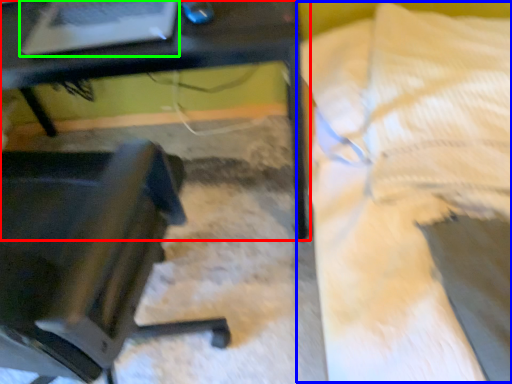
Question: Which object is positioned closest to table (highlighted by a red box)? Select from bed (highlighted by a blue box) and laptop (highlighted by a green box).

Choices:
 (A) bed
 (B) laptop

Answer: (B)